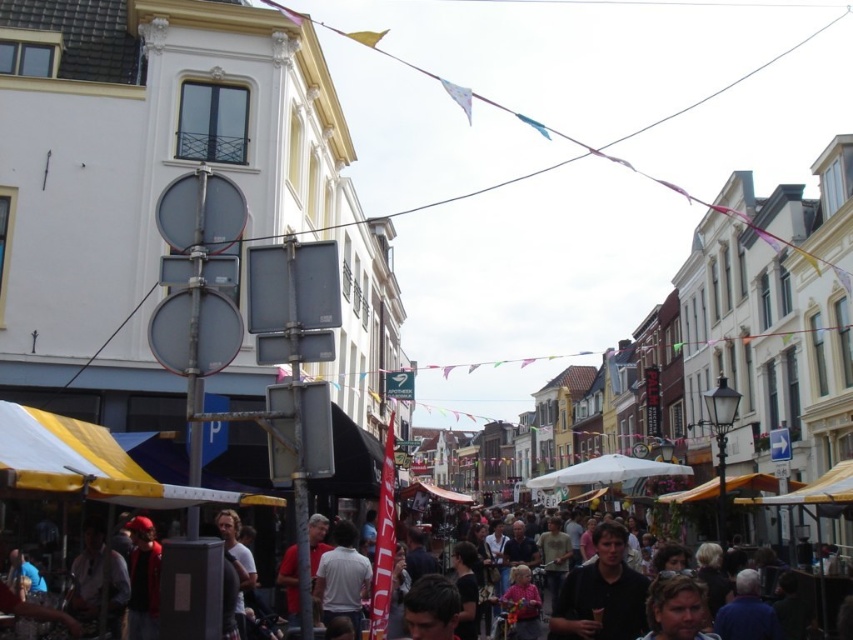
Question: Which point is closer to the camera?

Choices:
 (A) dark brown shirt at center
 (B) dark clothing crowd at center

Answer: (A)

Question: Is dark brown shirt at center above dark clothing crowd at center?

Choices:
 (A) yes
 (B) no

Answer: (B)

Question: Does dark brown shirt at center appear on the right side of dark clothing crowd at center?

Choices:
 (A) no
 (B) yes

Answer: (B)

Question: Which point appears closest to the camera in this image?

Choices:
 (A) (625, 564)
 (B) (1, 541)

Answer: (A)

Question: Considering the relative positions of dark brown shirt at center and dark clothing crowd at center in the image provided, where is dark brown shirt at center located with respect to dark clothing crowd at center?

Choices:
 (A) right
 (B) left

Answer: (A)

Question: Which object appears farthest from the camera in this image?

Choices:
 (A) dark brown shirt at center
 (B) dark clothing crowd at center

Answer: (B)